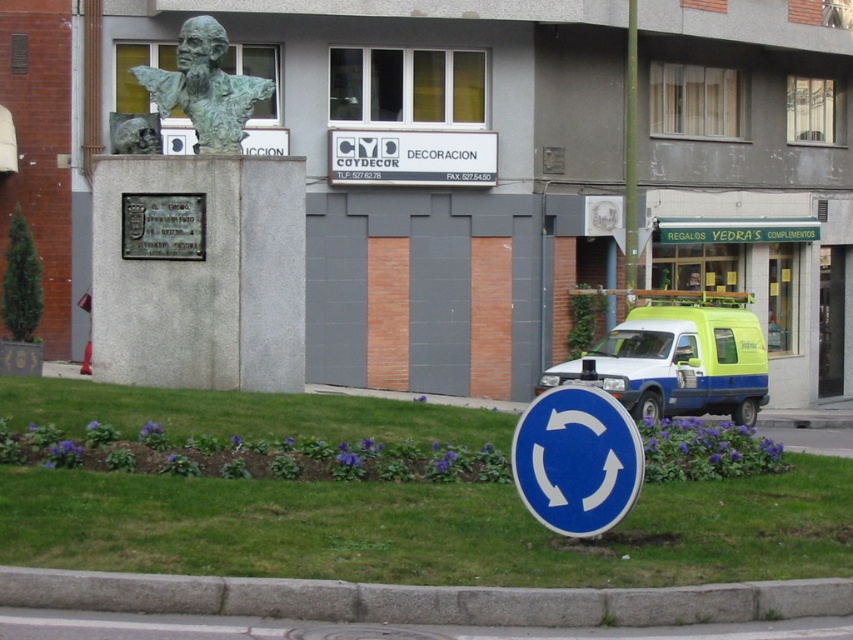
You are a delivery driver who needs to park your vehicle near the gray concrete curb at lower center. The parking space is marked at coordinates 0.938, 0.496. Can you confirm if the curb is exactly at this location?

Yes, the gray concrete curb at lower center is exactly at the coordinates (x=422, y=600), so you can park your vehicle there.

You are a city planner assessing the urban space. You need to install a new streetlight that must be at least 3 meters tall to provide adequate lighting. Given the bronze statue at upper center and the metallic pole at right, which object meets the height requirement?

The bronze statue at upper center is much taller than the metallic pole at right, so it meets the height requirement for the new streetlight installation.